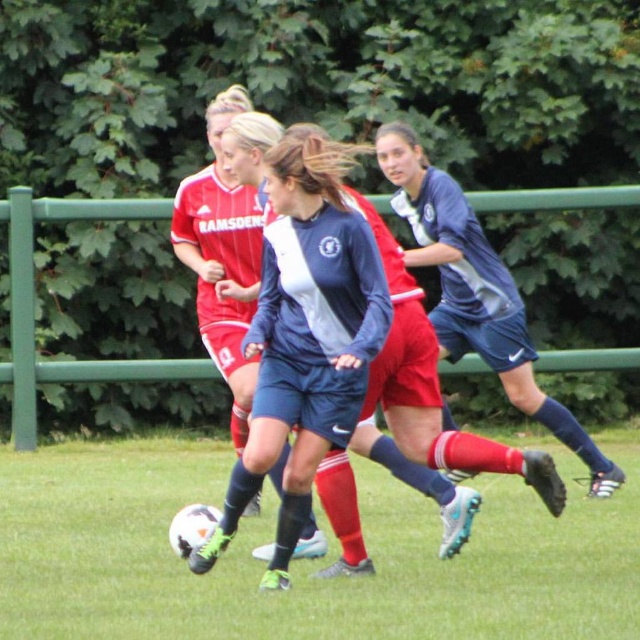
Question: Which object is the farthest from the blue fabric soccer jersey at center?

Choices:
 (A) blue fabric soccer ball at center
 (B) blue fabric jersey at center
 (C) white textured soccer ball at center

Answer: (B)

Question: Which point is closer to the camera?

Choices:
 (A) blue fabric jersey at center
 (B) blue fabric soccer ball at center
 (C) white textured soccer ball at center

Answer: (B)

Question: Which object is positioned closest to the blue fabric soccer jersey at center?

Choices:
 (A) blue fabric jersey at center
 (B) blue fabric soccer ball at center
 (C) white textured soccer ball at center

Answer: (B)

Question: Is white textured soccer ball at center to the right of blue fabric soccer jersey at center from the viewer's perspective?

Choices:
 (A) no
 (B) yes

Answer: (B)

Question: Does blue fabric soccer jersey at center have a lesser width compared to blue fabric jersey at center?

Choices:
 (A) yes
 (B) no

Answer: (A)

Question: Does blue fabric soccer ball at center appear under blue fabric jersey at center?

Choices:
 (A) no
 (B) yes

Answer: (B)